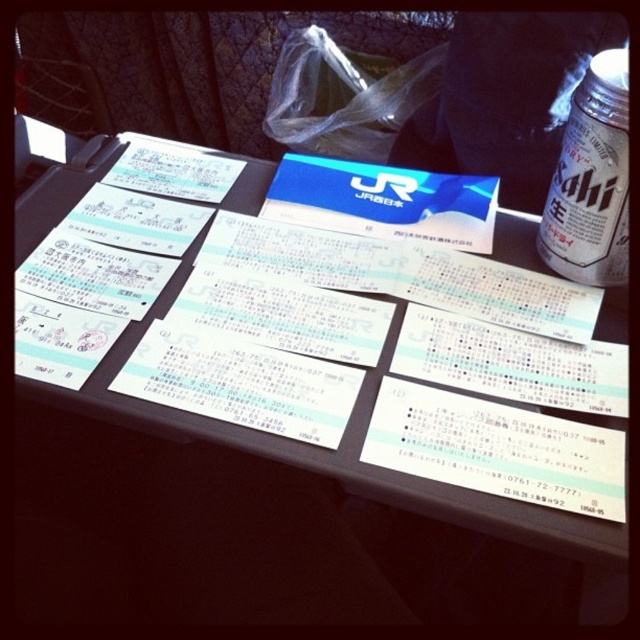
You are looking at a table with several items. There are two points marked on the table surface at coordinates point (x=360, y=404) and point (x=572, y=163). If you were to reach out to pick up an item from the table, which point would require your hand to move closer to you before reaching?

Point (x=360, y=404) is closer to the viewer than point (x=572, y=163), so you would need to move your hand closer to you to reach point (x=572, y=163) because it is further away.